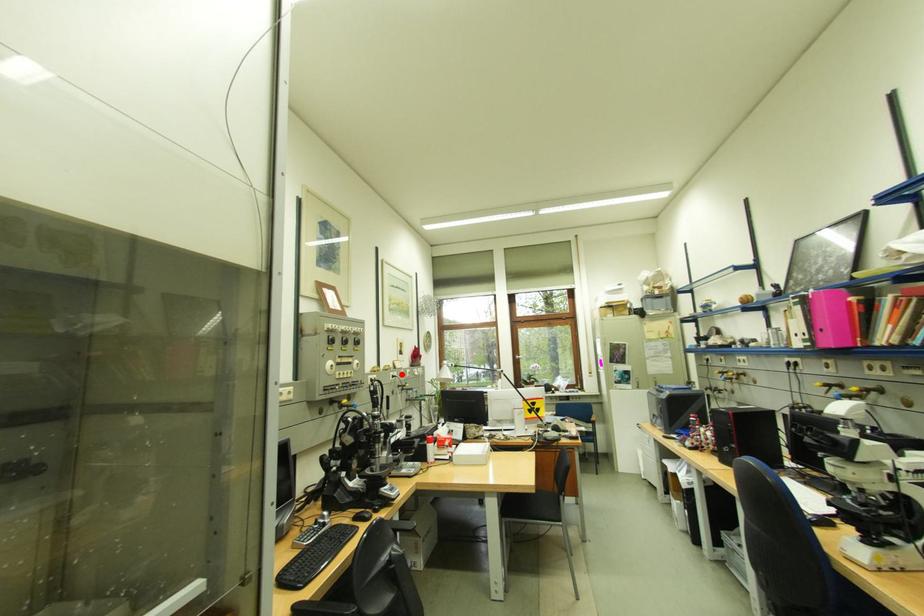
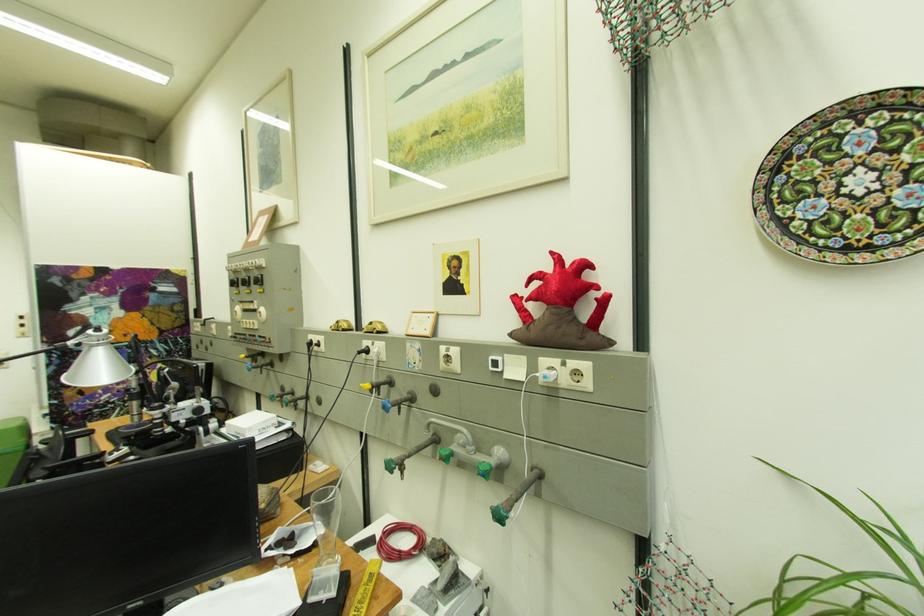
Where in the second image is the point corresponding to the highlighted location from the first image?

(375, 344)